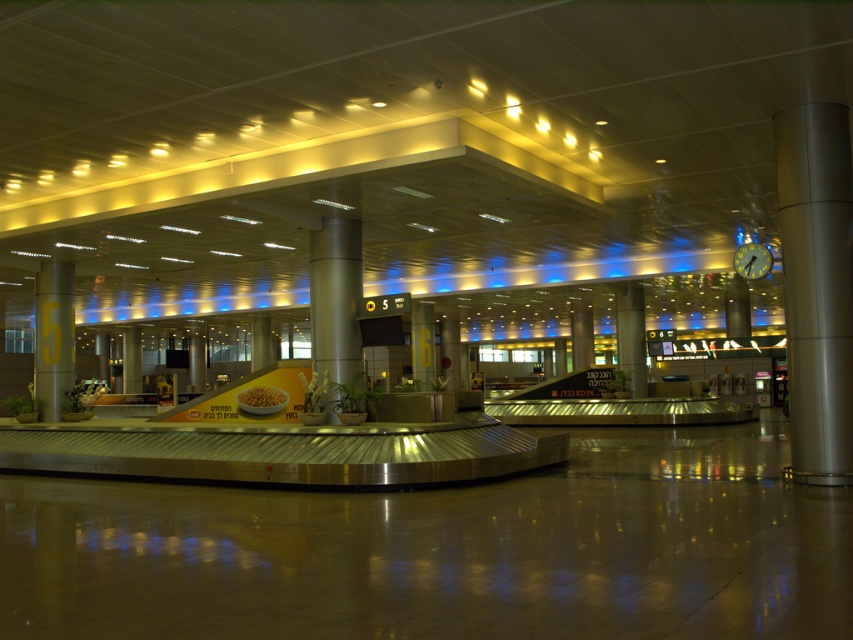
Between metallic column at right and silver metallic pillar at center, which one appears on the right side from the viewer's perspective?

Positioned to the right is metallic column at right.

Does metallic column at right appear on the right side of silver metallic pillar at center?

Indeed, metallic column at right is positioned on the right side of silver metallic pillar at center.

Identify the location of metallic column at right. This screenshot has height=640, width=853. point(816,285).

Can you confirm if yellow metallic pillar at left is positioned to the left of green glass clock at upper right?

Indeed, yellow metallic pillar at left is positioned on the left side of green glass clock at upper right.

Consider the image. Is yellow metallic pillar at left smaller than green glass clock at upper right?

No, yellow metallic pillar at left is not smaller than green glass clock at upper right.

Where is `yellow metallic pillar at left`? This screenshot has width=853, height=640. yellow metallic pillar at left is located at coordinates (53, 337).

Between point (635, 284) and point (740, 260), which one is positioned in front?

Point (740, 260) is in front.

Is satin silver column at center behind green glass clock at upper right?

Yes, it is behind green glass clock at upper right.

Does point (637, 305) come in front of point (752, 262)?

No, (637, 305) is behind (752, 262).

This screenshot has width=853, height=640. Identify the location of satin silver column at center. (631, 337).